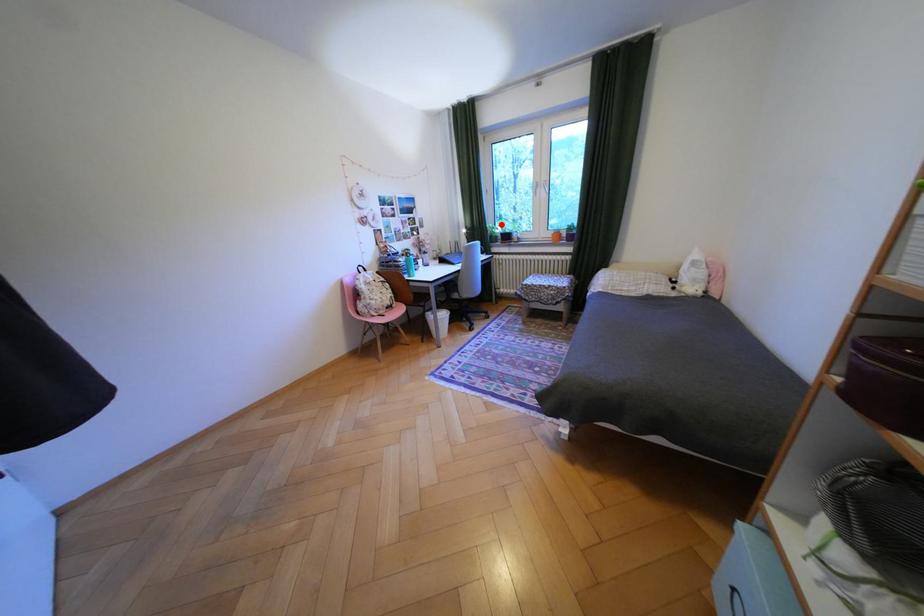
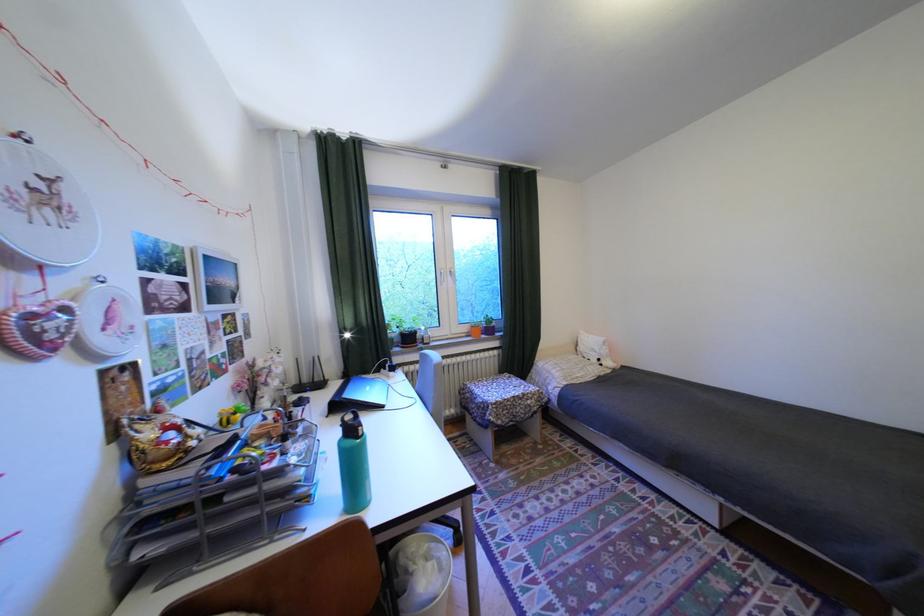
Where in the second image is the point corresponding to the highlighted location from the first image?

(397, 322)